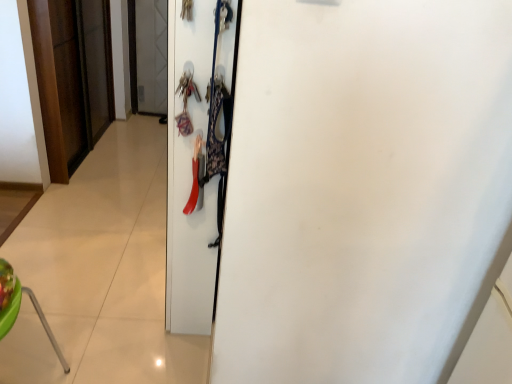
Find the location of a particular element. Image resolution: width=512 pixels, height=384 pixels. white matte door at center, which is counted as the second door, starting from the left is located at coordinates click(189, 180).

What do you see at coordinates (189, 180) in the screenshot? This screenshot has width=512, height=384. I see `white matte door at center, which is the first door in right-to-left order` at bounding box center [189, 180].

This screenshot has height=384, width=512. What do you see at coordinates (69, 82) in the screenshot?
I see `wooden door at left, which is the first door in left-to-right order` at bounding box center [69, 82].

Identify the location of wooden door at left, the 2th door positioned from the right. The image size is (512, 384). (69, 82).

Identify the location of white matte door at center, which is counted as the second door, starting from the left. (189, 180).

Considering the relative positions of white matte door at center, the 1th door viewed from the front, and wooden door at left, which ranks as the second door in front-to-back order, in the image provided, is white matte door at center, the 1th door viewed from the front, to the left of wooden door at left, which ranks as the second door in front-to-back order, from the viewer's perspective?

No, white matte door at center, the 1th door viewed from the front, is not to the left of wooden door at left, which ranks as the second door in front-to-back order.

Relative to wooden door at left, which is the 1th door in back-to-front order, is white matte door at center, the 1th door viewed from the front, in front or behind?

Clearly, white matte door at center, the 1th door viewed from the front, is in front of wooden door at left, which is the 1th door in back-to-front order.

Is point (187, 152) less distant than point (53, 7)?

Yes, point (187, 152) is in front of point (53, 7).

Based on the photo, from the image's perspective, is white matte door at center, which is the first door in right-to-left order, positioned above or below wooden door at left, the 2th door positioned from the right?

Clearly, from the image's perspective, white matte door at center, which is the first door in right-to-left order, is below wooden door at left, the 2th door positioned from the right.

From a real-world perspective, is white matte door at center, which is counted as the second door, starting from the left, physically below wooden door at left, which ranks as the second door in front-to-back order?

No, from a real-world perspective, white matte door at center, which is counted as the second door, starting from the left, is not beneath wooden door at left, which ranks as the second door in front-to-back order.

Which of these two, white matte door at center, which is the first door in right-to-left order, or wooden door at left, which ranks as the second door in front-to-back order, is thinner?

wooden door at left, which ranks as the second door in front-to-back order.

Between white matte door at center, the 1th door viewed from the front, and wooden door at left, the 2th door positioned from the right, which one has less height?

Standing shorter between the two is wooden door at left, the 2th door positioned from the right.

Which of these two, white matte door at center, the 1th door viewed from the front, or wooden door at left, which ranks as the second door in front-to-back order, is smaller?

wooden door at left, which ranks as the second door in front-to-back order, is smaller.

Is white matte door at center, which ranks as the second door in back-to-front order, not inside wooden door at left, the 2th door positioned from the right?

Yes, white matte door at center, which ranks as the second door in back-to-front order, is outside of wooden door at left, the 2th door positioned from the right.

Is white matte door at center, which is counted as the second door, starting from the left, positioned far away from wooden door at left, which is the first door in left-to-right order?

white matte door at center, which is counted as the second door, starting from the left, is positioned a significant distance from wooden door at left, which is the first door in left-to-right order.

From the picture: Is white matte door at center, which is counted as the second door, starting from the left, looking in the opposite direction of wooden door at left, the 2th door positioned from the right?

white matte door at center, which is counted as the second door, starting from the left, does not have its back to wooden door at left, the 2th door positioned from the right.

How different are the orientations of white matte door at center, which is the first door in right-to-left order, and wooden door at left, which is the first door in left-to-right order, in degrees?

The angular difference between white matte door at center, which is the first door in right-to-left order, and wooden door at left, which is the first door in left-to-right order, is 180 degrees.

Where is `door above the white matte door at center, which is the first door in right-to-left order (from the image's perspective)`? This screenshot has width=512, height=384. door above the white matte door at center, which is the first door in right-to-left order (from the image's perspective) is located at coordinates (69, 82).

Between wooden door at left, which is the 1th door in back-to-front order, and white matte door at center, which is the first door in right-to-left order, which one appears on the right side from the viewer's perspective?

white matte door at center, which is the first door in right-to-left order.

Is the depth of wooden door at left, which ranks as the second door in front-to-back order, less than that of white matte door at center, the 1th door viewed from the front?

That is False.

Is point (104, 80) closer or farther from the camera than point (176, 108)?

Point (104, 80) is farther from the camera than point (176, 108).

From the image's perspective, is wooden door at left, which ranks as the second door in front-to-back order, over white matte door at center, the 1th door viewed from the front?

Indeed, from the image's perspective, wooden door at left, which ranks as the second door in front-to-back order, is shown above white matte door at center, the 1th door viewed from the front.

From a real-world perspective, who is located lower, wooden door at left, which is the 1th door in back-to-front order, or white matte door at center, which is the first door in right-to-left order?

wooden door at left, which is the 1th door in back-to-front order, from a real-world perspective.

Is wooden door at left, which is the first door in left-to-right order, thinner than white matte door at center, which is counted as the second door, starting from the left?

Correct, the width of wooden door at left, which is the first door in left-to-right order, is less than that of white matte door at center, which is counted as the second door, starting from the left.

From their relative heights in the image, would you say wooden door at left, which is the 1th door in back-to-front order, is taller or shorter than white matte door at center, which is the first door in right-to-left order?

wooden door at left, which is the 1th door in back-to-front order, is shorter than white matte door at center, which is the first door in right-to-left order.

Between wooden door at left, the 2th door positioned from the right, and white matte door at center, the 1th door viewed from the front, which one has larger size?

white matte door at center, the 1th door viewed from the front, is bigger.

Would you say wooden door at left, the 2th door positioned from the right, is outside white matte door at center, the 1th door viewed from the front?

Yes, wooden door at left, the 2th door positioned from the right, is located beyond the bounds of white matte door at center, the 1th door viewed from the front.

Is wooden door at left, which is the 1th door in back-to-front order, touching white matte door at center, which is counted as the second door, starting from the left?

They are not placed beside each other.

Is wooden door at left, which is the first door in left-to-right order, positioned with its back to white matte door at center, the 1th door viewed from the front?

wooden door at left, which is the first door in left-to-right order, does not have its back to white matte door at center, the 1th door viewed from the front.

From the picture: Can you tell me how much wooden door at left, which ranks as the second door in front-to-back order, and white matte door at center, which ranks as the second door in back-to-front order, differ in facing direction?

180 degrees.

Locate an element on the screen. The width and height of the screenshot is (512, 384). door located behind the white matte door at center, which is counted as the second door, starting from the left is located at coordinates (69, 82).

The height and width of the screenshot is (384, 512). Identify the location of door lying in front of the wooden door at left, which is the first door in left-to-right order. (189, 180).

Where is `door behind the white matte door at center, which ranks as the second door in back-to-front order`? This screenshot has width=512, height=384. door behind the white matte door at center, which ranks as the second door in back-to-front order is located at coordinates (69, 82).